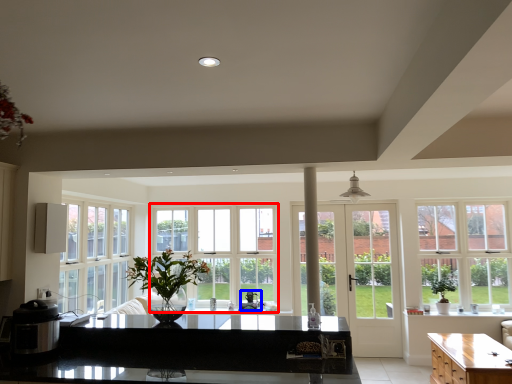
Question: Which of the following is the farthest to the observer, window (highlighted by a red box) or appliance (highlighted by a blue box)?

Choices:
 (A) window
 (B) appliance

Answer: (A)